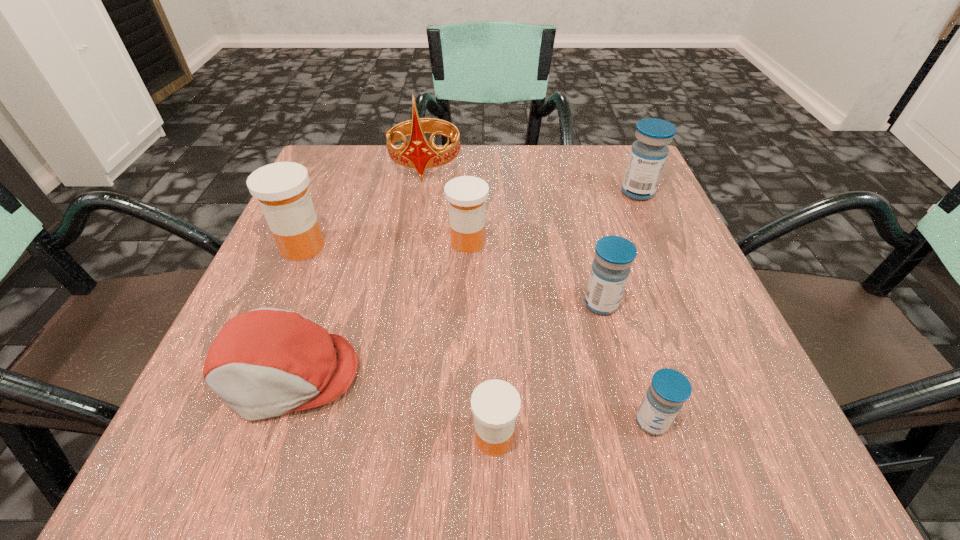
In order to click on medicine that is at the far edge in this screenshot , I will do `click(648, 155)`.

Identify the location of cap positioned at the near edge. This screenshot has width=960, height=540. (266, 362).

Image resolution: width=960 pixels, height=540 pixels. Find the location of `medicine present at the left edge`. medicine present at the left edge is located at coordinates (281, 188).

Where is `cap that is at the left edge`? The height and width of the screenshot is (540, 960). cap that is at the left edge is located at coordinates (266, 362).

You are a GUI agent. You are given a task and a screenshot of the screen. Output one action in this format:
    pyautogui.click(x=<x>, y=<y>)
    Task: Click on the object positioned at the near left corner
    The height and width of the screenshot is (540, 960).
    Given the screenshot: What is the action you would take?
    pyautogui.click(x=266, y=362)

The width and height of the screenshot is (960, 540). Identify the location of object located in the far right corner section of the desktop. (648, 155).

Where is `object positioned at the near right corner`? Image resolution: width=960 pixels, height=540 pixels. object positioned at the near right corner is located at coordinates (669, 389).

The image size is (960, 540). In order to click on vacant space at the far edge of the desktop in this screenshot , I will do `click(550, 180)`.

I want to click on vacant region at the near edge of the desktop, so click(461, 466).

You are a GUI agent. You are given a task and a screenshot of the screen. Output one action in this format:
    pyautogui.click(x=<x>, y=<y>)
    Task: Click on the free space at the left edge of the desktop
    
    Given the screenshot: What is the action you would take?
    pyautogui.click(x=352, y=205)